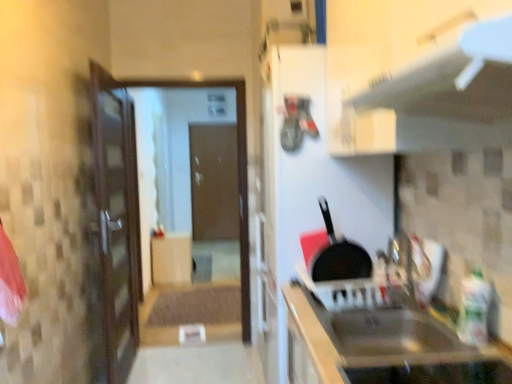
Question: Can black matte frying pan at center be found inside matte wood cabinet at center, arranged as the second cabinetry when viewed from the right?

Choices:
 (A) no
 (B) yes

Answer: (A)

Question: Is matte wood cabinet at center, the 1th cabinetry positioned from the back, at the left side of black matte frying pan at center?

Choices:
 (A) yes
 (B) no

Answer: (A)

Question: From the image's perspective, is matte wood cabinet at center, the 1th cabinetry positioned from the back, under black matte frying pan at center?

Choices:
 (A) no
 (B) yes

Answer: (B)

Question: Can you confirm if matte wood cabinet at center, the 1th cabinetry positioned from the back, is smaller than black matte frying pan at center?

Choices:
 (A) no
 (B) yes

Answer: (A)

Question: Does matte wood cabinet at center, the 1th cabinetry positioned from the back, have a larger size compared to black matte frying pan at center?

Choices:
 (A) no
 (B) yes

Answer: (B)

Question: Does matte wood cabinet at center, marked as the 1th cabinetry in a left-to-right arrangement, have a lesser width compared to black matte frying pan at center?

Choices:
 (A) yes
 (B) no

Answer: (B)

Question: Considering the relative sizes of brown matte door at center and black matte frying pan at center in the image provided, is brown matte door at center smaller than black matte frying pan at center?

Choices:
 (A) no
 (B) yes

Answer: (A)

Question: Does brown matte door at center lie in front of black matte frying pan at center?

Choices:
 (A) no
 (B) yes

Answer: (A)

Question: Is brown matte door at center wider than black matte frying pan at center?

Choices:
 (A) yes
 (B) no

Answer: (A)

Question: Is brown matte door at center placed right next to black matte frying pan at center?

Choices:
 (A) no
 (B) yes

Answer: (A)

Question: From a real-world perspective, does brown matte door at center stand above black matte frying pan at center?

Choices:
 (A) yes
 (B) no

Answer: (B)

Question: Considering the relative positions of brown matte door at center and black matte frying pan at center in the image provided, is brown matte door at center to the right of black matte frying pan at center from the viewer's perspective?

Choices:
 (A) no
 (B) yes

Answer: (A)

Question: Does metallic gray exhaust hood at upper center have a lesser height compared to matte wood cabinet at center, marked as the 1th cabinetry in a left-to-right arrangement?

Choices:
 (A) no
 (B) yes

Answer: (B)